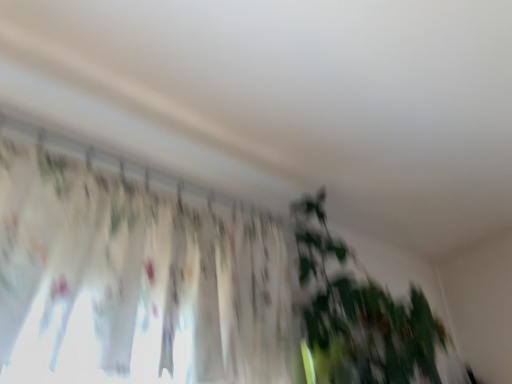
Question: Should I look upward or downward to see green leafy plant at center?

Choices:
 (A) down
 (B) up

Answer: (A)